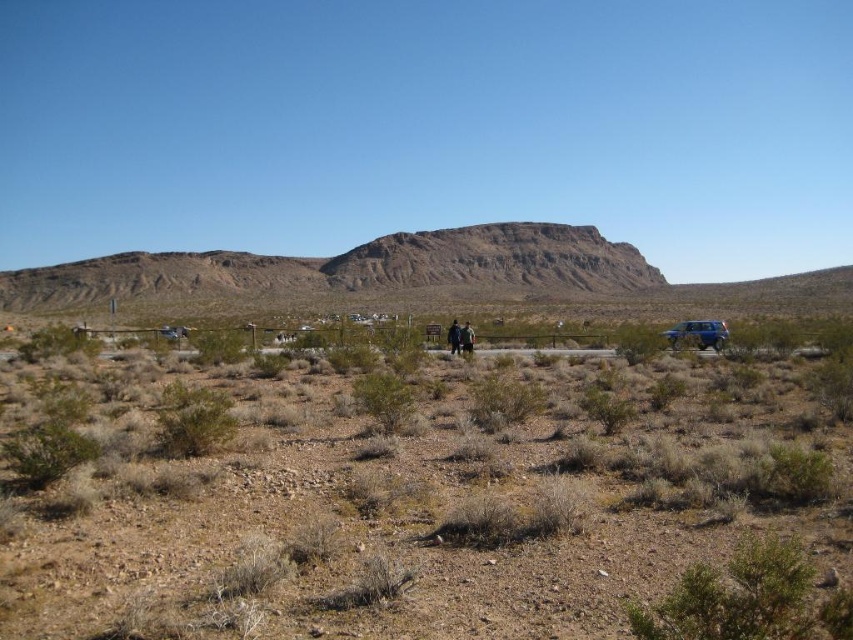
Question: Which object appears farthest from the camera in this image?

Choices:
 (A) blue metallic jeep at lower right
 (B) brown sandy dirt field at center
 (C) brown leather jacket at center
 (D) rugged brown mountain at center

Answer: (D)

Question: Which of the following is the closest to the observer?

Choices:
 (A) (77, 273)
 (B) (698, 337)
 (C) (456, 330)

Answer: (B)

Question: Does brown sandy dirt field at center have a larger size compared to rugged brown mountain at center?

Choices:
 (A) no
 (B) yes

Answer: (A)

Question: Which of the following is the closest to the observer?

Choices:
 (A) (657, 276)
 (B) (456, 342)

Answer: (B)

Question: Does rugged brown mountain at center appear under brown leather jacket at center?

Choices:
 (A) yes
 (B) no

Answer: (B)

Question: Does blue metallic jeep at lower right have a larger size compared to brown leather jacket at center?

Choices:
 (A) no
 (B) yes

Answer: (B)